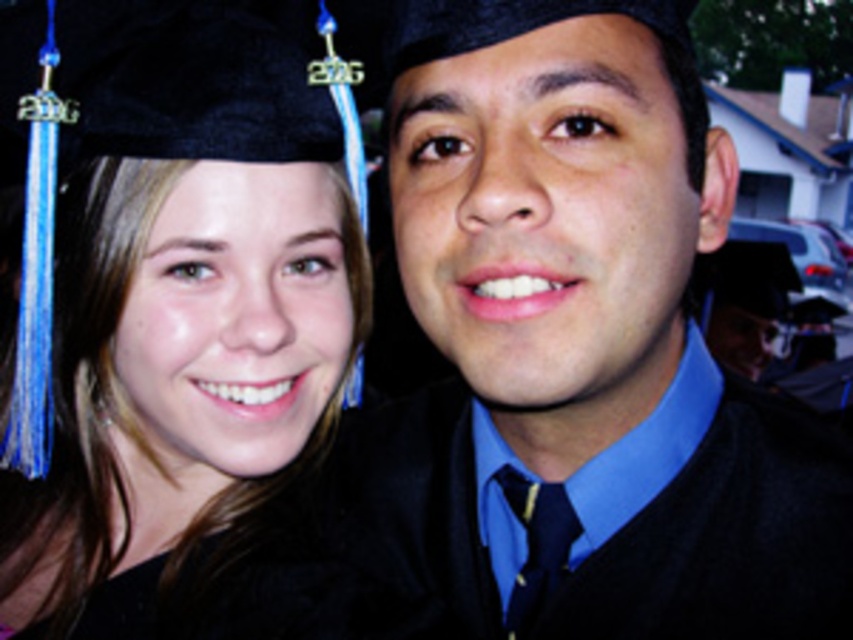
Question: Which is nearer to the matte black graduation cap at upper left?

Choices:
 (A) black matte graduation cap at upper left
 (B) black woolen sweater at right

Answer: (B)

Question: Observing the image, what is the correct spatial positioning of matte black graduation cap at upper left in reference to black woolen sweater at right?

Choices:
 (A) right
 (B) left

Answer: (A)

Question: Does matte black graduation cap at upper left appear under black woolen sweater at right?

Choices:
 (A) no
 (B) yes

Answer: (A)

Question: Which point is farther to the camera?

Choices:
 (A) (175, 147)
 (B) (573, 529)

Answer: (B)

Question: Is black matte graduation cap at upper left behind black woolen sweater at right?

Choices:
 (A) no
 (B) yes

Answer: (A)

Question: Which point appears farthest from the camera in this image?

Choices:
 (A) (231, 54)
 (B) (767, 435)
 (C) (705, 496)

Answer: (B)